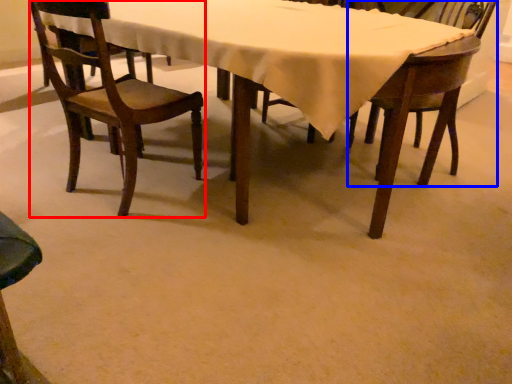
Question: Which point is closer to the camera, chair (highlighted by a red box) or chair (highlighted by a blue box)?

Choices:
 (A) chair
 (B) chair

Answer: (A)